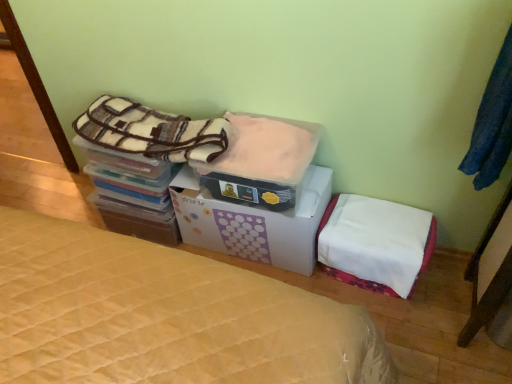
Question: In terms of width, does dark blue fabric at upper right look wider or thinner when compared to white fabric mattress at lower right?

Choices:
 (A) thin
 (B) wide

Answer: (A)

Question: Is dark blue fabric at upper right situated inside white fabric mattress at lower right or outside?

Choices:
 (A) outside
 (B) inside

Answer: (A)

Question: Which is farther from the white fabric mattress at lower right?

Choices:
 (A) plush fleece blanket at upper left, which is counted as the first blanket, starting from the left
 (B) fuzzy pink blanket at center, positioned as the first blanket in right-to-left order
 (C) dark blue fabric at upper right
 (D) white cardboard box at center

Answer: (A)

Question: Which of these objects is positioned closest to the dark blue fabric at upper right?

Choices:
 (A) fuzzy pink blanket at center, which is the 2th blanket from left to right
 (B) white fabric mattress at lower right
 (C) plush fleece blanket at upper left, the 2th blanket from the right
 (D) white cardboard box at center

Answer: (B)